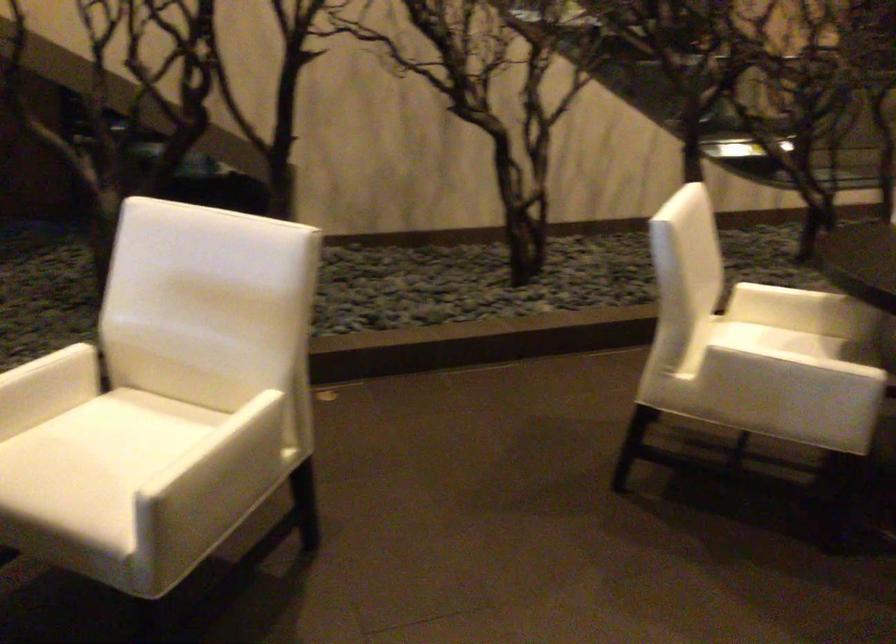
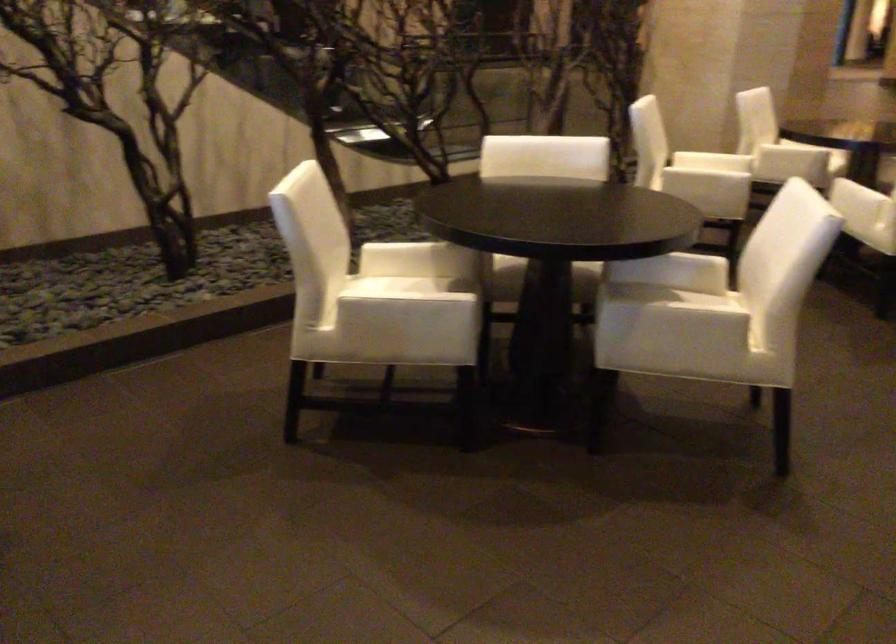
Question: The first image is from the beginning of the video and the second image is from the end. How did the camera likely rotate when shooting the video?

Choices:
 (A) Left
 (B) Right
 (C) Up
 (D) Down

Answer: (B)